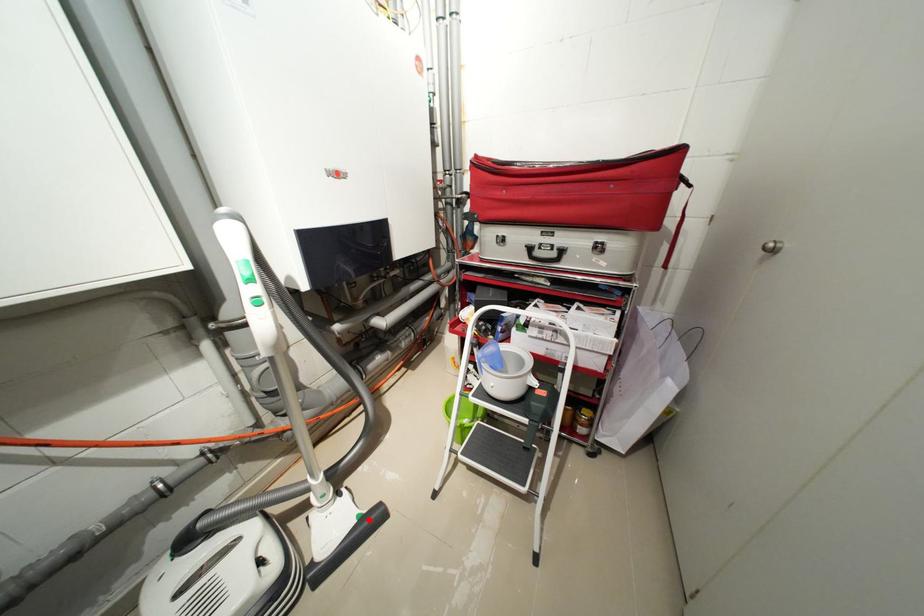
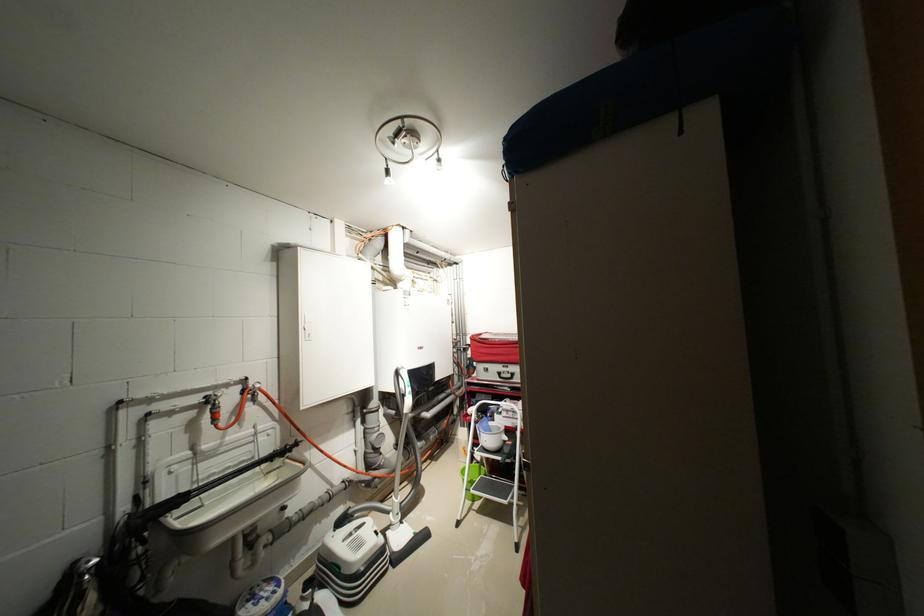
Question: I am providing you with two images of the same scene from different viewpoints. Given a red point in image1, look at the same physical point in image2. Is it:

Choices:
 (A) Closer to the viewpoint
 (B) Farther from the viewpoint

Answer: (A)